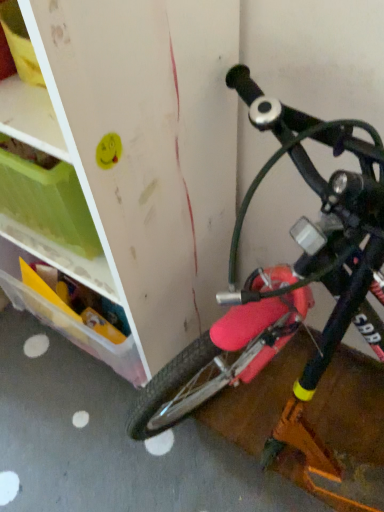
Question: Does translucent plastic storage box at left have a lesser height compared to pink matte bicycle at right?

Choices:
 (A) yes
 (B) no

Answer: (A)

Question: Is translucent plastic storage box at left at the right side of pink matte bicycle at right?

Choices:
 (A) no
 (B) yes

Answer: (A)

Question: Can you confirm if translucent plastic storage box at left is thinner than pink matte bicycle at right?

Choices:
 (A) yes
 (B) no

Answer: (A)

Question: Does translucent plastic storage box at left have a smaller size compared to pink matte bicycle at right?

Choices:
 (A) yes
 (B) no

Answer: (A)

Question: From a real-world perspective, does translucent plastic storage box at left sit lower than pink matte bicycle at right?

Choices:
 (A) no
 (B) yes

Answer: (B)

Question: Does translucent plastic storage box at left have a larger size compared to pink matte bicycle at right?

Choices:
 (A) yes
 (B) no

Answer: (B)

Question: Considering the relative sizes of pink matte bicycle at right and translucent plastic storage box at left in the image provided, is pink matte bicycle at right shorter than translucent plastic storage box at left?

Choices:
 (A) no
 (B) yes

Answer: (A)

Question: Is pink matte bicycle at right further to the viewer compared to translucent plastic storage box at left?

Choices:
 (A) no
 (B) yes

Answer: (A)

Question: Does pink matte bicycle at right have a greater width compared to translucent plastic storage box at left?

Choices:
 (A) yes
 (B) no

Answer: (A)

Question: Are pink matte bicycle at right and translucent plastic storage box at left located far from each other?

Choices:
 (A) no
 (B) yes

Answer: (A)

Question: Is pink matte bicycle at right facing towards translucent plastic storage box at left?

Choices:
 (A) no
 (B) yes

Answer: (A)

Question: From a real-world perspective, is pink matte bicycle at right over translucent plastic storage box at left?

Choices:
 (A) yes
 (B) no

Answer: (A)

Question: Does point (157, 384) appear closer or farther from the camera than point (13, 252)?

Choices:
 (A) farther
 (B) closer

Answer: (B)